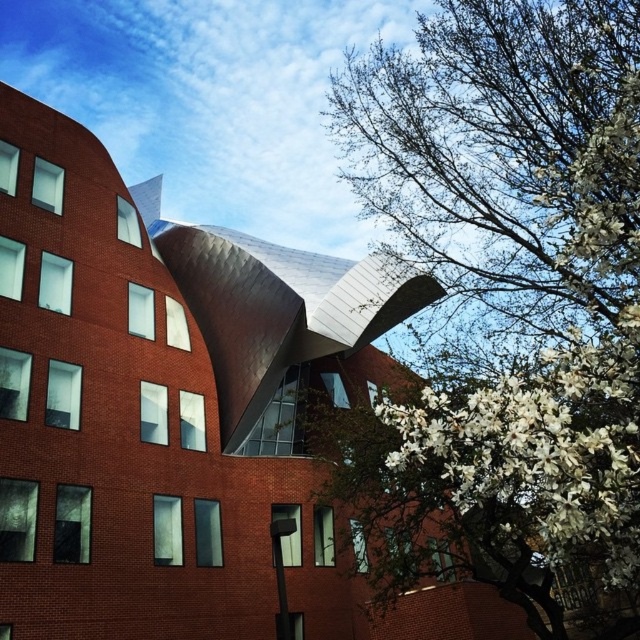
You are a drone operator trying to capture a photo of the white blossoms at upper right and the white fluffy petals at right. The drone can only focus on objects within a 3.5 meter range. Can the drone focus on both objects at the same time?

The distance between the white blossoms at upper right and white fluffy petals at right is 4.50 meters, which exceeds the drone camera focus range of 3.5 meters. Therefore, the drone cannot focus on both objects simultaneously.

You are an architect analyzing the composition of this image. You need to determine the spatial relationship between the white blossoms at upper right and the white fluffy petals at right. Which one is positioned higher in the scene?

The white blossoms at upper right is positioned higher than the white fluffy petals at right.

You are standing at the point closest to you in the image. Which point, point (474,406) or point (557,456), is farther away from your current position?

Point (474,406) is behind point (557,456), so it is farther away from your current position.